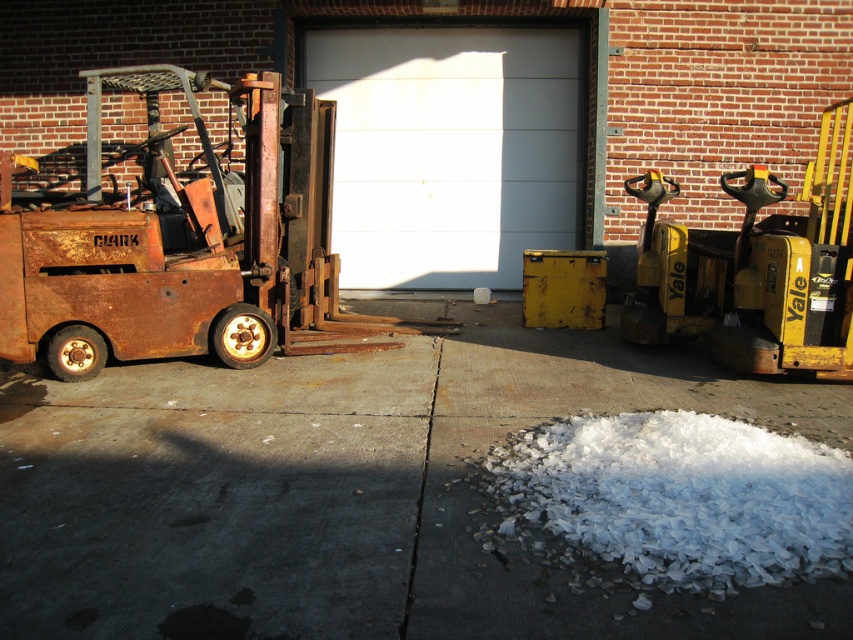
Which is more to the right, rusty metal forklift at left or white flaky snow at lower center?

Positioned to the right is white flaky snow at lower center.

Between rusty metal forklift at left and white flaky snow at lower center, which one has more height?

rusty metal forklift at left is taller.

Find the location of a particular element. rusty metal forklift at left is located at coordinates (189, 248).

Image resolution: width=853 pixels, height=640 pixels. I want to click on rusty metal forklift at left, so click(x=189, y=248).

The height and width of the screenshot is (640, 853). I want to click on concrete pavement at center, so click(347, 490).

The height and width of the screenshot is (640, 853). Find the location of `concrete pavement at center`. concrete pavement at center is located at coordinates (347, 490).

The width and height of the screenshot is (853, 640). Identify the location of concrete pavement at center. (347, 490).

Can you confirm if white smooth garage door at center is positioned to the right of white flaky snow at lower center?

Incorrect, white smooth garage door at center is not on the right side of white flaky snow at lower center.

Is white smooth garage door at center thinner than white flaky snow at lower center?

No, white smooth garage door at center is not thinner than white flaky snow at lower center.

Is point (456, 182) positioned in front of point (618, 518)?

No.

Image resolution: width=853 pixels, height=640 pixels. I want to click on white smooth garage door at center, so click(x=450, y=148).